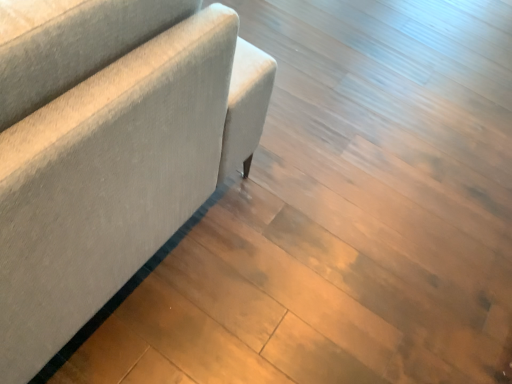
You are a GUI agent. You are given a task and a screenshot of the screen. Output one action in this format:
    pyautogui.click(x=<x>, y=<y>)
    Task: Click on the gray fabric couch at left
    
    Given the screenshot: What is the action you would take?
    pyautogui.click(x=108, y=149)

Describe the element at coordinates (108, 149) in the screenshot. I see `gray fabric couch at left` at that location.

I want to click on gray fabric couch at left, so click(x=108, y=149).